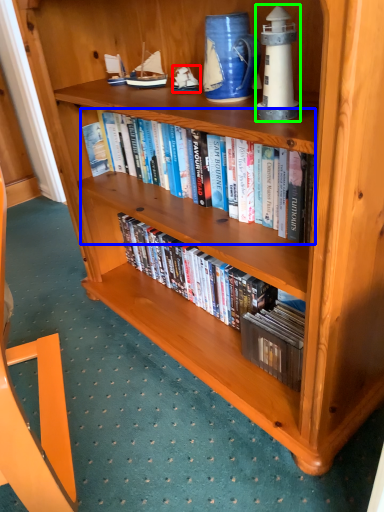
Question: Which object is the farthest from toy (highlighted by a red box)? Choose among these: book (highlighted by a blue box) or toy (highlighted by a green box).

Choices:
 (A) book
 (B) toy

Answer: (B)